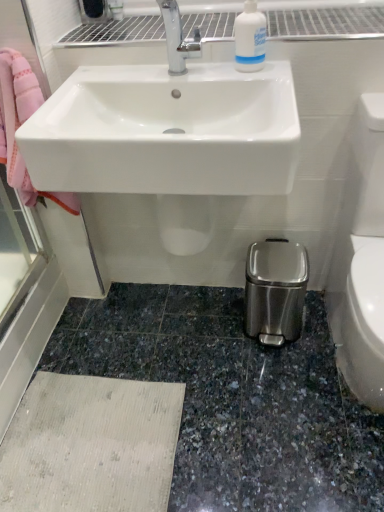
Question: From a real-world perspective, is white glossy toilet bowl at lower right on white plastic bottle at upper center?

Choices:
 (A) no
 (B) yes

Answer: (A)

Question: Is white glossy toilet bowl at lower right wider than white plastic bottle at upper center?

Choices:
 (A) no
 (B) yes

Answer: (B)

Question: Can you confirm if white glossy toilet bowl at lower right is thinner than white plastic bottle at upper center?

Choices:
 (A) no
 (B) yes

Answer: (A)

Question: Is white glossy toilet bowl at lower right oriented away from white plastic bottle at upper center?

Choices:
 (A) no
 (B) yes

Answer: (A)

Question: Does white glossy toilet bowl at lower right touch white plastic bottle at upper center?

Choices:
 (A) yes
 (B) no

Answer: (B)

Question: From a real-world perspective, is white plastic bottle at upper center above or below white glossy toilet bowl at lower right?

Choices:
 (A) below
 (B) above

Answer: (B)

Question: Is point (238, 49) closer or farther from the camera than point (377, 198)?

Choices:
 (A) closer
 (B) farther

Answer: (A)

Question: Considering the positions of white plastic bottle at upper center and white glossy toilet bowl at lower right in the image, is white plastic bottle at upper center wider or thinner than white glossy toilet bowl at lower right?

Choices:
 (A) wide
 (B) thin

Answer: (B)

Question: Is white plastic bottle at upper center taller or shorter than white glossy toilet bowl at lower right?

Choices:
 (A) short
 (B) tall

Answer: (A)

Question: From a real-world perspective, is white glossy sink at upper center above or below white plastic bottle at upper center?

Choices:
 (A) below
 (B) above

Answer: (A)

Question: Is white glossy sink at upper center situated inside white plastic bottle at upper center or outside?

Choices:
 (A) inside
 (B) outside

Answer: (B)

Question: Considering the positions of white glossy sink at upper center and white plastic bottle at upper center in the image, is white glossy sink at upper center bigger or smaller than white plastic bottle at upper center?

Choices:
 (A) small
 (B) big

Answer: (B)

Question: From the image's perspective, is white glossy sink at upper center positioned above or below white plastic bottle at upper center?

Choices:
 (A) below
 (B) above

Answer: (A)

Question: Is white plastic bottle at upper center in front of or behind white glossy sink at upper center in the image?

Choices:
 (A) front
 (B) behind

Answer: (B)

Question: Is point (259, 59) closer or farther from the camera than point (223, 64)?

Choices:
 (A) closer
 (B) farther

Answer: (A)